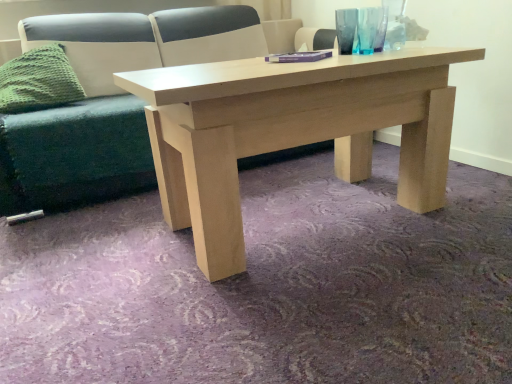
Question: Is green fabric couch at center to the left or to the right of green knitted pillow at left in the image?

Choices:
 (A) right
 (B) left

Answer: (A)

Question: From the image's perspective, is green fabric couch at center above or below green knitted pillow at left?

Choices:
 (A) above
 (B) below

Answer: (A)

Question: Which object is the farthest from the transparent glass vase at upper right?

Choices:
 (A) purple matte book at center
 (B) green knitted pillow at left
 (C) green fabric couch at center

Answer: (B)

Question: Which is farther from the transparent glass vase at upper right?

Choices:
 (A) green knitted pillow at left
 (B) purple matte book at center
 (C) green fabric couch at center

Answer: (A)